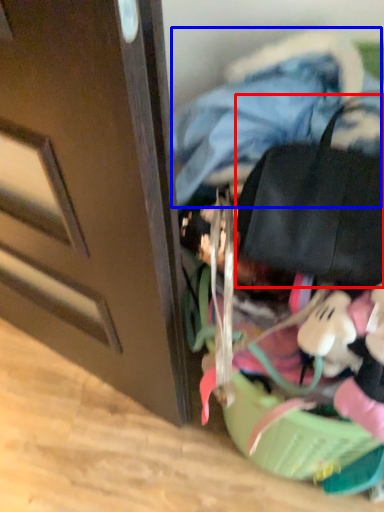
Question: Which object is closer to the camera taking this photo, messenger bag (highlighted by a red box) or clothing (highlighted by a blue box)?

Choices:
 (A) messenger bag
 (B) clothing

Answer: (A)